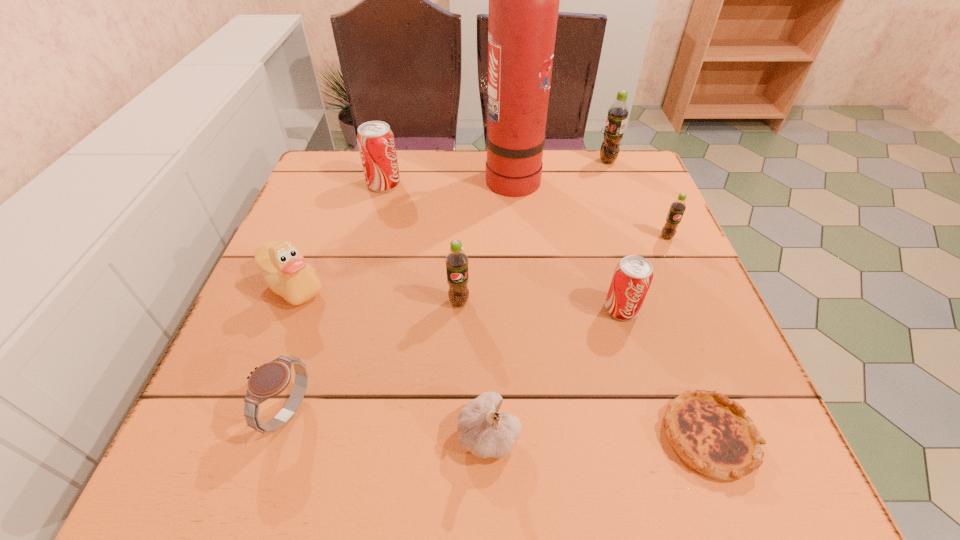
Where is `vacant space that satisfies the following two spatial constraints: 1. on the front side of the watch; 2. on the right side of the quiche`? vacant space that satisfies the following two spatial constraints: 1. on the front side of the watch; 2. on the right side of the quiche is located at coordinates (280, 436).